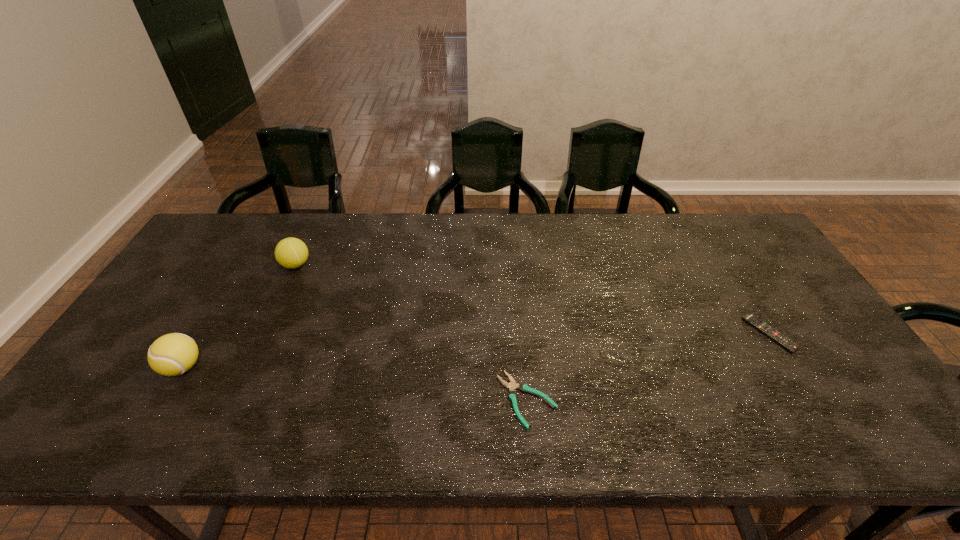
Locate an element on the screen. object that is positioned at the far edge is located at coordinates (291, 253).

Find the location of a particular element. object positioned at the near edge is located at coordinates (512, 386).

Locate an element on the screen. The width and height of the screenshot is (960, 540). object that is positioned at the left edge is located at coordinates (173, 354).

You are a GUI agent. You are given a task and a screenshot of the screen. Output one action in this format:
    pyautogui.click(x=<x>, y=<y>)
    Task: Click on the object at the right edge
    The image size is (960, 540).
    Given the screenshot: What is the action you would take?
    pyautogui.click(x=763, y=327)

This screenshot has height=540, width=960. What are the coordinates of `vacant region at the far edge of the desktop` in the screenshot? It's located at (677, 230).

What are the coordinates of `vacant space at the near edge of the desktop` in the screenshot? It's located at (304, 417).

The height and width of the screenshot is (540, 960). In the image, there is a desktop. What are the coordinates of `free space at the right edge` in the screenshot? It's located at (807, 330).

Identify the location of free space at the far right corner of the desktop. (756, 244).

In the image, there is a desktop. Where is `vacant area at the near right corner`? Image resolution: width=960 pixels, height=540 pixels. vacant area at the near right corner is located at coordinates (848, 430).

The image size is (960, 540). In order to click on empty space that is in between the left tennis ball and the pliers in this screenshot , I will do `click(355, 383)`.